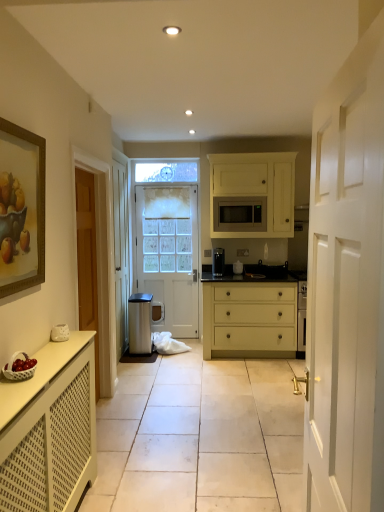
Question: Does white matte drawer at center have a greater width compared to wooden framed painting at left?

Choices:
 (A) yes
 (B) no

Answer: (A)

Question: From a real-world perspective, is white matte drawer at center physically above wooden framed painting at left?

Choices:
 (A) yes
 (B) no

Answer: (B)

Question: From the image's perspective, is white matte drawer at center below wooden framed painting at left?

Choices:
 (A) no
 (B) yes

Answer: (B)

Question: Is white matte drawer at center thinner than wooden framed painting at left?

Choices:
 (A) yes
 (B) no

Answer: (B)

Question: Does white matte drawer at center have a greater height compared to wooden framed painting at left?

Choices:
 (A) yes
 (B) no

Answer: (A)

Question: Does point (271, 265) appear closer or farther from the camera than point (238, 180)?

Choices:
 (A) closer
 (B) farther

Answer: (B)

Question: Looking at their shapes, would you say black matte stove at center, the second appliance positioned from the left, is wider or thinner than white matte cabinet at center, the 2th cabinetry viewed from the front?

Choices:
 (A) wide
 (B) thin

Answer: (B)

Question: Considering the positions of black matte stove at center, which is the 1th appliance in right-to-left order, and white matte cabinet at center, the 2th cabinetry when ordered from bottom to top, in the image, is black matte stove at center, which is the 1th appliance in right-to-left order, taller or shorter than white matte cabinet at center, the 2th cabinetry when ordered from bottom to top,?

Choices:
 (A) tall
 (B) short

Answer: (B)

Question: Based on their sizes in the image, would you say black matte stove at center, which is the 1th appliance in right-to-left order, is bigger or smaller than white matte cabinet at center, placed as the 1th cabinetry when sorted from back to front?

Choices:
 (A) big
 (B) small

Answer: (B)

Question: Looking at the image, does black matte stove at center, which is the 1th appliance in right-to-left order, seem bigger or smaller compared to satin silver microwave at center?

Choices:
 (A) big
 (B) small

Answer: (B)

Question: In the image, is black matte stove at center, which is the 1th appliance in right-to-left order, positioned in front of or behind satin silver microwave at center?

Choices:
 (A) behind
 (B) front

Answer: (A)

Question: From a real-world perspective, is black matte stove at center, which is the 1th appliance in right-to-left order, physically located above or below satin silver microwave at center?

Choices:
 (A) below
 (B) above

Answer: (A)

Question: Considering the positions of point (278, 270) and point (238, 205), is point (278, 270) closer or farther from the camera than point (238, 205)?

Choices:
 (A) farther
 (B) closer

Answer: (A)

Question: From the image's perspective, is white matte drawer at center located above or below white matte cabinet at lower left, acting as the first cabinetry starting from the left?

Choices:
 (A) below
 (B) above

Answer: (B)

Question: Choose the correct answer: Is white matte drawer at center inside white matte cabinet at lower left, positioned as the first cabinetry in front-to-back order, or outside it?

Choices:
 (A) outside
 (B) inside

Answer: (A)